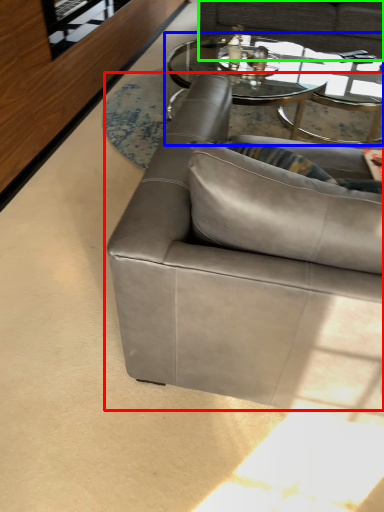
Question: Which object is positioned farthest from studio couch (highlighted by a red box)? Select from coffee table (highlighted by a blue box) and studio couch (highlighted by a green box).

Choices:
 (A) coffee table
 (B) studio couch

Answer: (B)